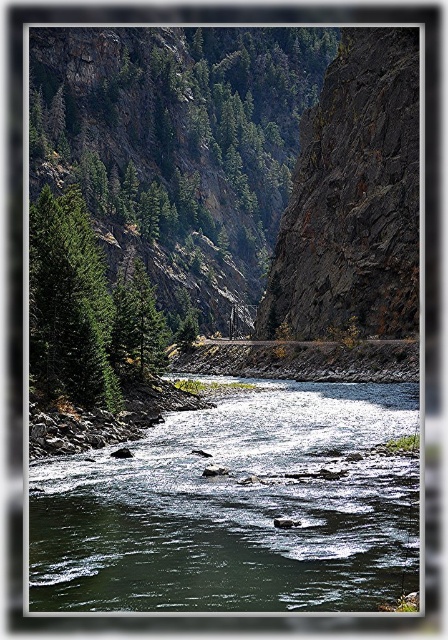
Question: Which object is the farthest from the green matte tree at center-left?

Choices:
 (A) green matte tree at left
 (B) green smooth water at center

Answer: (B)

Question: Does green smooth water at center appear under green matte tree at center-left?

Choices:
 (A) no
 (B) yes

Answer: (B)

Question: Is green smooth water at center smaller than green matte tree at left?

Choices:
 (A) yes
 (B) no

Answer: (A)

Question: Does green smooth water at center have a smaller size compared to green matte tree at center-left?

Choices:
 (A) no
 (B) yes

Answer: (B)

Question: Estimate the real-world distances between objects in this image. Which object is closer to the green matte tree at center-left?

Choices:
 (A) green smooth water at center
 (B) green matte tree at left

Answer: (B)

Question: Among these points, which one is nearest to the camera?

Choices:
 (A) (33, 349)
 (B) (369, 588)
 (C) (112, 289)

Answer: (B)